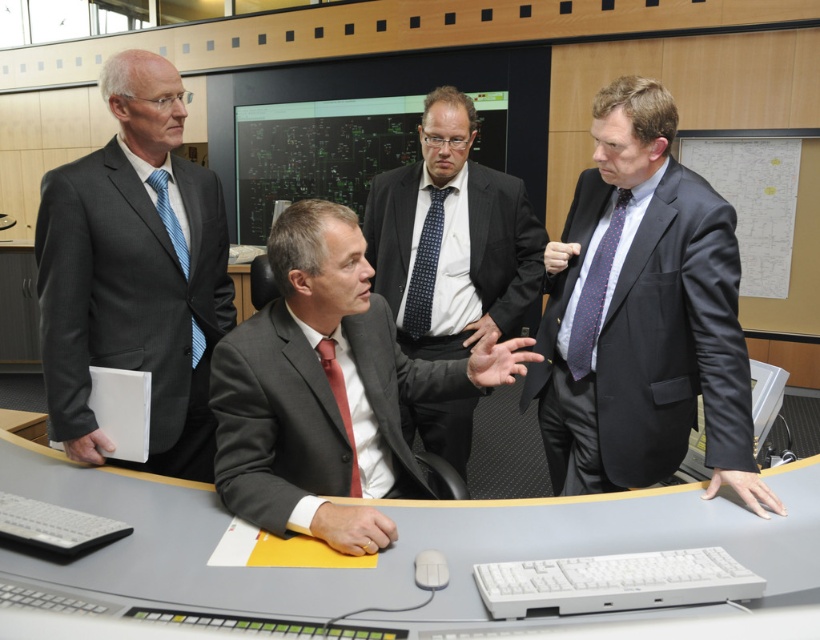
Question: Does black plastic computer at lower right have a larger size compared to blue striped tie at center?

Choices:
 (A) yes
 (B) no

Answer: (A)

Question: Considering the relative positions of matte gray suit at center and black plastic computer at lower right in the image provided, where is matte gray suit at center located with respect to black plastic computer at lower right?

Choices:
 (A) left
 (B) right

Answer: (A)

Question: Among these points, which one is farthest from the camera?

Choices:
 (A) (759, 432)
 (B) (418, 272)

Answer: (B)

Question: Which object is farther from the camera taking this photo?

Choices:
 (A) black plastic computer at lower right
 (B) matte red tie at center

Answer: (B)

Question: In this image, where is matte black suit at center located relative to blue striped tie at center?

Choices:
 (A) left
 (B) right

Answer: (B)

Question: Which of the following is the closest to the observer?

Choices:
 (A) (352, 490)
 (B) (403, 416)

Answer: (A)